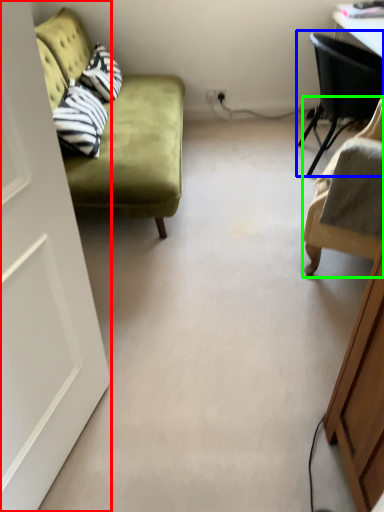
Question: Which object is the farthest from door (highlighted by a red box)? Choose among these: chair (highlighted by a blue box) or chair (highlighted by a green box).

Choices:
 (A) chair
 (B) chair

Answer: (A)